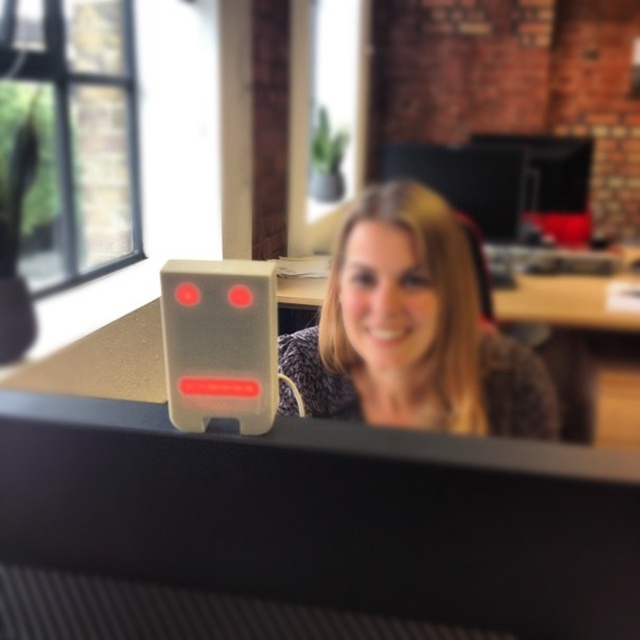
Is the position of black plastic computer monitor at center more distant than that of speckled fabric shirt at center?

No, black plastic computer monitor at center is closer to the viewer.

Can you confirm if black plastic computer monitor at center is positioned below speckled fabric shirt at center?

Indeed, black plastic computer monitor at center is positioned under speckled fabric shirt at center.

This screenshot has height=640, width=640. In order to click on black plastic computer monitor at center in this screenshot , I will do `click(326, 515)`.